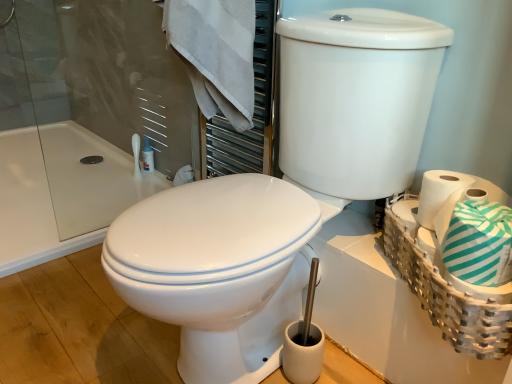
Find the location of `white glossy toilet at center, which is the first toilet in right-to-left order`. white glossy toilet at center, which is the first toilet in right-to-left order is located at coordinates (281, 195).

Where is `white glossy toilet at center, which is the 1th toilet from left to right`? white glossy toilet at center, which is the 1th toilet from left to right is located at coordinates (217, 267).

Considering the sizes of white woven basket at right and white glossy toilet at center, positioned as the 2th toilet in right-to-left order, in the image, is white woven basket at right taller or shorter than white glossy toilet at center, positioned as the 2th toilet in right-to-left order,?

Clearly, white woven basket at right is taller compared to white glossy toilet at center, positioned as the 2th toilet in right-to-left order.

From a real-world perspective, is white woven basket at right beneath white glossy toilet at center, positioned as the 2th toilet in right-to-left order?

No, from a real-world perspective, white woven basket at right is not below white glossy toilet at center, positioned as the 2th toilet in right-to-left order.

Considering the sizes of objects white woven basket at right and white glossy toilet at center, which is the 1th toilet from left to right, in the image provided, who is thinner, white woven basket at right or white glossy toilet at center, which is the 1th toilet from left to right,?

With smaller width is white woven basket at right.

Is white woven basket at right far away from white glossy toilet at center, positioned as the 2th toilet in right-to-left order?

They are positioned close to each other.

Is white glossy toilet at center, positioned as the 2th toilet in left-to-right order, to the right of white woven basket at right from the viewer's perspective?

No.

From the image's perspective, between white glossy toilet at center, positioned as the 2th toilet in left-to-right order, and white woven basket at right, which one is located above?

white glossy toilet at center, positioned as the 2th toilet in left-to-right order, is shown above in the image.

Starting from the white woven basket at right, which toilet is the 1st one to the left? Please provide its 2D coordinates.

[(281, 195)]

From the image's perspective, who appears lower, teal striped toilet paper at right or white glossy toilet at center, which is the 1th toilet from left to right?

white glossy toilet at center, which is the 1th toilet from left to right, from the image's perspective.

Which object is positioned more to the left, teal striped toilet paper at right or white glossy toilet at center, which is the 1th toilet from left to right?

white glossy toilet at center, which is the 1th toilet from left to right.

Based on the photo, is teal striped toilet paper at right spatially inside white glossy toilet at center, positioned as the 2th toilet in right-to-left order, or outside of it?

teal striped toilet paper at right cannot be found inside white glossy toilet at center, positioned as the 2th toilet in right-to-left order.

Is teal striped toilet paper at right looking in the opposite direction of white glossy toilet at center, positioned as the 2th toilet in right-to-left order?

No, white glossy toilet at center, positioned as the 2th toilet in right-to-left order, is not at the back of teal striped toilet paper at right.

Who is taller, white plastic bottle at upper left or white cotton towel at upper left?

With more height is white cotton towel at upper left.

Is white plastic bottle at upper left positioned far away from white cotton towel at upper left?

No.

Which is closer to the camera, (x=151, y=171) or (x=196, y=33)?

Point (x=151, y=171) appears to be farther away from the viewer than point (x=196, y=33).

Does white plastic bottle at upper left come behind white cotton towel at upper left?

Yes, the depth of white plastic bottle at upper left is greater than that of white cotton towel at upper left.

From the image's perspective, is white plastic bottle at upper left located beneath white woven basket at right?

No.

Considering the positions of objects white plastic bottle at upper left and white woven basket at right in the image provided, who is more to the left, white plastic bottle at upper left or white woven basket at right?

From the viewer's perspective, white plastic bottle at upper left appears more on the left side.

Between white plastic bottle at upper left and white woven basket at right, which one has larger width?

Wider between the two is white woven basket at right.

Is white cotton towel at upper left oriented away from white plastic bottle at upper left?

No, white cotton towel at upper left's orientation is not away from white plastic bottle at upper left.

Is white plastic bottle at upper left a part of white cotton towel at upper left?

No.

Can you tell me how much white cotton towel at upper left and white plastic bottle at upper left differ in facing direction?

The angular difference between white cotton towel at upper left and white plastic bottle at upper left is 26.9 degrees.

Which object is positioned more to the left, white glossy toilet at center, positioned as the 2th toilet in left-to-right order, or white glossy toilet at center, positioned as the 2th toilet in right-to-left order?

white glossy toilet at center, positioned as the 2th toilet in right-to-left order, is more to the left.

From a real-world perspective, which object rests below the other?

white glossy toilet at center, which is the 1th toilet from left to right, is physically lower.

Locate an element on the screen. toilet on the left side of white glossy toilet at center, positioned as the 2th toilet in left-to-right order is located at coordinates (217, 267).

Is white glossy toilet at center, positioned as the 2th toilet in left-to-right order, positioned behind white glossy toilet at center, which is the 1th toilet from left to right?

No, white glossy toilet at center, positioned as the 2th toilet in left-to-right order, is in front of white glossy toilet at center, which is the 1th toilet from left to right.

This screenshot has width=512, height=384. What are the coordinates of `basket above the white glossy toilet at center, which is the 1th toilet from left to right (from a real-world perspective)` in the screenshot? It's located at (446, 295).

From the white woven basket at right, count the 1st toilet to the left and point to it. Please provide its 2D coordinates.

[(281, 195)]

Which object lies nearer to the anchor point teal striped toilet paper at right, white cotton towel at upper left or white glossy toilet at center, positioned as the 2th toilet in right-to-left order?

Based on the image, white glossy toilet at center, positioned as the 2th toilet in right-to-left order, appears to be nearer to teal striped toilet paper at right.

Considering their positions, is white glossy toilet at center, which is the first toilet in right-to-left order, positioned closer to teal striped toilet paper at right than white woven basket at right?

white woven basket at right is closer to teal striped toilet paper at right.

Estimate the real-world distances between objects in this image. Which object is closer to teal striped toilet paper at right, white glossy toilet at center, positioned as the 2th toilet in left-to-right order, or white plastic bottle at upper left?

white glossy toilet at center, positioned as the 2th toilet in left-to-right order, is positioned closer to the anchor teal striped toilet paper at right.

Estimate the real-world distances between objects in this image. Which object is closer to white glossy toilet at center, which is the first toilet in right-to-left order, white plastic bottle at upper left or white glossy toilet at center, positioned as the 2th toilet in right-to-left order?

white glossy toilet at center, positioned as the 2th toilet in right-to-left order.

Looking at the image, which one is located closer to white glossy toilet at center, positioned as the 2th toilet in right-to-left order, white plastic bottle at upper left or white cotton towel at upper left?

Among the two, white cotton towel at upper left is located nearer to white glossy toilet at center, positioned as the 2th toilet in right-to-left order.

Estimate the real-world distances between objects in this image. Which object is closer to teal striped toilet paper at right, white glossy toilet at center, which is the 1th toilet from left to right, or white plastic bottle at upper left?

Among the two, white glossy toilet at center, which is the 1th toilet from left to right, is located nearer to teal striped toilet paper at right.

From the image, which object appears to be nearer to white plastic bottle at upper left, white glossy toilet at center, which is the 1th toilet from left to right, or teal striped toilet paper at right?

Among the two, white glossy toilet at center, which is the 1th toilet from left to right, is located nearer to white plastic bottle at upper left.

From the image, which object appears to be farther from white glossy toilet at center, which is the 1th toilet from left to right, teal striped toilet paper at right or white woven basket at right?

Among the two, teal striped toilet paper at right is located further to white glossy toilet at center, which is the 1th toilet from left to right.

The width and height of the screenshot is (512, 384). Identify the location of bath towel located between white glossy toilet at center, which is the 1th toilet from left to right, and teal striped toilet paper at right in the left-right direction. (216, 53).

Find the location of a particular element. The image size is (512, 384). toilet positioned between white glossy toilet at center, positioned as the 2th toilet in left-to-right order, and white plastic bottle at upper left from near to far is located at coordinates (217, 267).

This screenshot has height=384, width=512. What are the coordinates of `basket between white glossy toilet at center, which is the first toilet in right-to-left order, and white plastic bottle at upper left from front to back` in the screenshot? It's located at (446, 295).

At what (x,y) coordinates should I click in order to perform the action: click on basket located between teal striped toilet paper at right and white plastic bottle at upper left in the depth direction. Please return your answer as a coordinate pair (x, y). The height and width of the screenshot is (384, 512). Looking at the image, I should click on (446, 295).